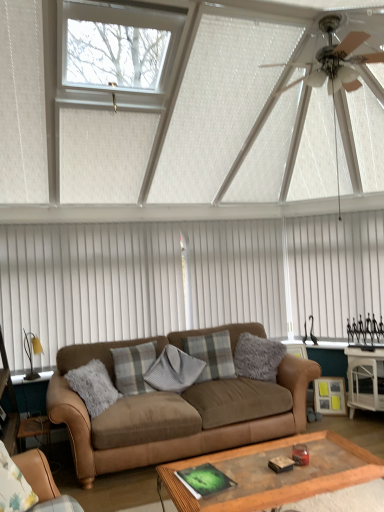
In order to face plaid fabric pillow at center, which appears as the 4th pillow when viewed from the right, should I rotate leftwards or rightwards?

To face it directly, rotate left by 6.916 degrees.

How much space does brown leather couch at center, acting as the 2th studio couch starting from the front, occupy horizontally?

1.03 meters.

What do you see at coordinates (334, 55) in the screenshot? The height and width of the screenshot is (512, 384). I see `metallic silver ceiling fan at upper right` at bounding box center [334, 55].

This screenshot has height=512, width=384. In order to click on plaid fabric pillow at center, the first pillow when ordered from left to right in this screenshot , I will do `click(133, 367)`.

Where is `studio couch lying behind the wooden glass coffee table at center`? This screenshot has width=384, height=512. studio couch lying behind the wooden glass coffee table at center is located at coordinates pos(176,410).

Is brown leather couch at center, marked as the first studio couch in a back-to-front arrangement, looking in the opposite direction of wooden glass coffee table at center?

brown leather couch at center, marked as the first studio couch in a back-to-front arrangement, does not have its back to wooden glass coffee table at center.

From a real-world perspective, relative to wooden glass coffee table at center, is brown leather couch at center, marked as the first studio couch in a back-to-front arrangement, vertically above or below?

brown leather couch at center, marked as the first studio couch in a back-to-front arrangement, is situated higher than wooden glass coffee table at center in the real world.

Is brown leather couch at center, acting as the 2th studio couch starting from the front, smaller than wooden glass coffee table at center?

Actually, brown leather couch at center, acting as the 2th studio couch starting from the front, might be larger than wooden glass coffee table at center.

Who is taller, plaid fabric pillow at center, the first pillow when ordered from left to right, or metallic silver ceiling fan at upper right?

With more height is plaid fabric pillow at center, the first pillow when ordered from left to right.

Considering the positions of points (130, 362) and (284, 91), is point (130, 362) farther from camera compared to point (284, 91)?

Yes.

Does plaid fabric pillow at center, which appears as the 4th pillow when viewed from the right, lie in front of metallic silver ceiling fan at upper right?

No, plaid fabric pillow at center, which appears as the 4th pillow when viewed from the right, is further to the viewer.

Would you say plaid fabric pillow at center, the first pillow when ordered from left to right, contains metallic silver ceiling fan at upper right?

No, metallic silver ceiling fan at upper right is located outside of plaid fabric pillow at center, the first pillow when ordered from left to right.

Is clear glass window at upper center positioned with its back to metallic silver ceiling fan at upper right?

No, clear glass window at upper center is not facing the opposite direction of metallic silver ceiling fan at upper right.

Find the location of `ceiling fan that appears below the clear glass window at upper center (from a real-world perspective)`. ceiling fan that appears below the clear glass window at upper center (from a real-world perspective) is located at coordinates (334, 55).

Are clear glass window at upper center and metallic silver ceiling fan at upper right making contact?

No.

From the image's perspective, which is below, clear glass window at upper center or metallic silver ceiling fan at upper right?

metallic silver ceiling fan at upper right, from the image's perspective.

Does brown leather couch at center, acting as the 2th studio couch starting from the front, have a greater height compared to clear glass window at upper center?

Correct, brown leather couch at center, acting as the 2th studio couch starting from the front, is much taller as clear glass window at upper center.

Can you see brown leather couch at center, acting as the 2th studio couch starting from the front, touching clear glass window at upper center?

brown leather couch at center, acting as the 2th studio couch starting from the front, is not next to clear glass window at upper center, and they're not touching.

Considering the relative sizes of brown leather couch at center, acting as the 2th studio couch starting from the front, and clear glass window at upper center in the image provided, is brown leather couch at center, acting as the 2th studio couch starting from the front, wider than clear glass window at upper center?

Yes.

Based on their sizes in the image, would you say brown leather couch at center, acting as the 2th studio couch starting from the front, is bigger or smaller than clear glass window at upper center?

In the image, brown leather couch at center, acting as the 2th studio couch starting from the front, appears to be larger than clear glass window at upper center.

From the image's perspective, is white vertical blinds at upper center above clear glass window at upper center?

Incorrect, from the image's perspective, white vertical blinds at upper center is lower than clear glass window at upper center.

From a real-world perspective, is white vertical blinds at upper center physically below clear glass window at upper center?

Yes, from a real-world perspective, white vertical blinds at upper center is beneath clear glass window at upper center.

What's the angular difference between white vertical blinds at upper center and clear glass window at upper center's facing directions?

44.1 degrees separate the facing orientations of white vertical blinds at upper center and clear glass window at upper center.

Can you tell me how much clear glass window at upper center and white vertical blinds at center differ in facing direction?

clear glass window at upper center and white vertical blinds at center are facing 0.693 degrees away from each other.

Considering their positions, is clear glass window at upper center located in front of or behind white vertical blinds at center?

In the image, clear glass window at upper center appears in front of white vertical blinds at center.

In the scene shown: Which is more to the left, clear glass window at upper center or white vertical blinds at center?

clear glass window at upper center is more to the left.

Do you think clear glass window at upper center is within white vertical blinds at center, or outside of it?

clear glass window at upper center is located beyond the bounds of white vertical blinds at center.

Which is closer, (271,425) or (379,379)?

The point (271,425) is closer.

From a real-world perspective, is brown leather couch at center, marked as the first studio couch in a back-to-front arrangement, physically below white glossy side table at lower right?

A: No, from a real-world perspective, brown leather couch at center, marked as the first studio couch in a back-to-front arrangement, is not under white glossy side table at lower right.

Locate an element on the screen. coffee table lying on the right of brown leather couch at center, marked as the first studio couch in a back-to-front arrangement is located at coordinates (275, 473).

From the image's perspective, starting from the metallic silver ceiling fan at upper right, which pillow is the 3rd one below? Please provide its 2D coordinates.

[(133, 367)]

Estimate the real-world distances between objects in this image. Which object is closer to white vertical blinds at center, fuzzy gray pillow at center, the fourth pillow when ordered from left to right, or metallic silver ceiling fan at upper right?

fuzzy gray pillow at center, the fourth pillow when ordered from left to right.

Estimate the real-world distances between objects in this image. Which object is further from plaid fabric pillow at center, the first pillow when ordered from left to right, clear glass window at upper center or plaid fabric pillow at center, the second pillow in the right-to-left sequence?

clear glass window at upper center is positioned further to the anchor plaid fabric pillow at center, the first pillow when ordered from left to right.

Looking at this image, estimate the real-world distances between objects in this image. Which object is further from white vertical blinds at center, wooden glass coffee table at center or plaid fabric pillow at center, the second pillow in the right-to-left sequence?

wooden glass coffee table at center is further to white vertical blinds at center.

From the image, which object appears to be nearer to white vertical blinds at center, white glossy side table at lower right or plush gray pillow at center, which appears as the 3th pillow when viewed from the right?

plush gray pillow at center, which appears as the 3th pillow when viewed from the right, is positioned closer to the anchor white vertical blinds at center.

Considering their positions, is fuzzy gray pillow at center, the fourth pillow when ordered from left to right, positioned further to plaid fabric pillow at center, the first pillow when ordered from left to right, than clear glass window at upper center?

clear glass window at upper center is further to plaid fabric pillow at center, the first pillow when ordered from left to right.

When comparing their distances from plaid fabric pillow at center, which is the 3th pillow in left-to-right order, does plaid fabric pillow at center, the first pillow when ordered from left to right, or metallic silver ceiling fan at upper right seem further?

metallic silver ceiling fan at upper right.

Based on their spatial positions, is metallic silver ceiling fan at upper right or plaid fabric pillow at center, which appears as the 4th pillow when viewed from the right, closer to white glossy side table at lower right?

plaid fabric pillow at center, which appears as the 4th pillow when viewed from the right, lies closer to white glossy side table at lower right than the other object.

Based on the photo, looking at the image, which one is located further to plush gray pillow at center, which appears as the 3th pillow when viewed from the right, white vertical blinds at upper center or white glossy side table at lower right?

The object further to plush gray pillow at center, which appears as the 3th pillow when viewed from the right, is white vertical blinds at upper center.

Identify the location of ceiling fan between clear glass window at upper center and brown leather couch at center, acting as the 2th studio couch starting from the front, from top to bottom. This screenshot has height=512, width=384. (334, 55).

What are the coordinates of `blind between metallic silver ceiling fan at upper right and plaid fabric pillow at center, the second pillow in the right-to-left sequence, in the up-down direction` in the screenshot? It's located at (186, 278).

I want to click on blind between clear glass window at upper center and brown leather couch at center, marked as the first studio couch in a back-to-front arrangement, from top to bottom, so click(186, 278).

Where is `curtain between brown leather couch at lower left, which ranks as the 2th studio couch in back-to-front order, and white glossy side table at lower right, in the horizontal direction`? The height and width of the screenshot is (512, 384). curtain between brown leather couch at lower left, which ranks as the 2th studio couch in back-to-front order, and white glossy side table at lower right, in the horizontal direction is located at coordinates (335, 270).